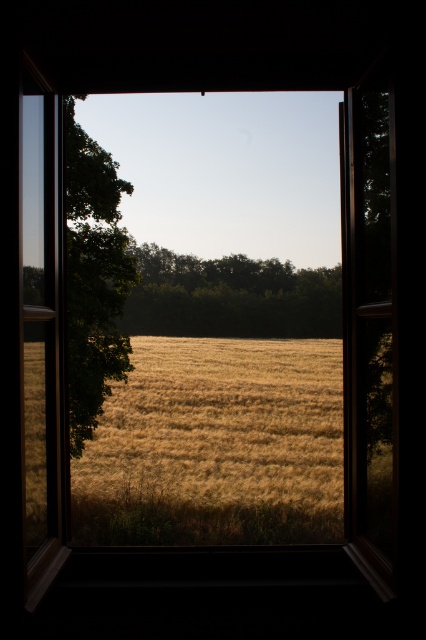
Can you confirm if green leafy tree at left is smaller than green leafy tree at center?

Yes, green leafy tree at left is smaller than green leafy tree at center.

Between green leafy tree at left and green leafy tree at center, which one appears on the left side from the viewer's perspective?

green leafy tree at left

The height and width of the screenshot is (640, 426). What do you see at coordinates (94, 276) in the screenshot?
I see `green leafy tree at left` at bounding box center [94, 276].

Locate an element on the screen. Image resolution: width=426 pixels, height=640 pixels. green leafy tree at left is located at coordinates (94, 276).